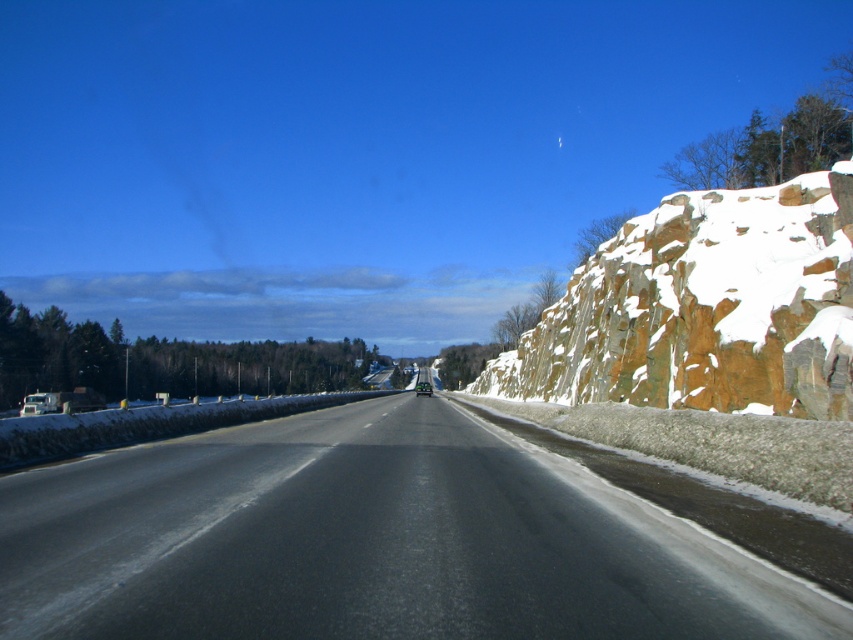
Where is `black asphalt highway at center`? black asphalt highway at center is located at coordinates (368, 541).

Is black asphalt highway at center thinner than snowy rock wall at right?

Indeed, black asphalt highway at center has a lesser width compared to snowy rock wall at right.

Describe the element at coordinates (368, 541) in the screenshot. The width and height of the screenshot is (853, 640). I see `black asphalt highway at center` at that location.

The height and width of the screenshot is (640, 853). I want to click on black asphalt highway at center, so click(368, 541).

Between black asphalt highway at center and green matte car at center, which one appears on the right side from the viewer's perspective?

From the viewer's perspective, green matte car at center appears more on the right side.

Based on the photo, does black asphalt highway at center have a lesser width compared to green matte car at center?

No.

Who is more distant from viewer, [10,508] or [421,381]?

The point [421,381] is more distant.

Locate an element on the screen. This screenshot has height=640, width=853. black asphalt highway at center is located at coordinates (368, 541).

Measure the distance between point (705, 378) and camera.

A distance of 23.88 meters exists between point (705, 378) and camera.

Find the location of a particular element. snowy rock wall at right is located at coordinates (705, 308).